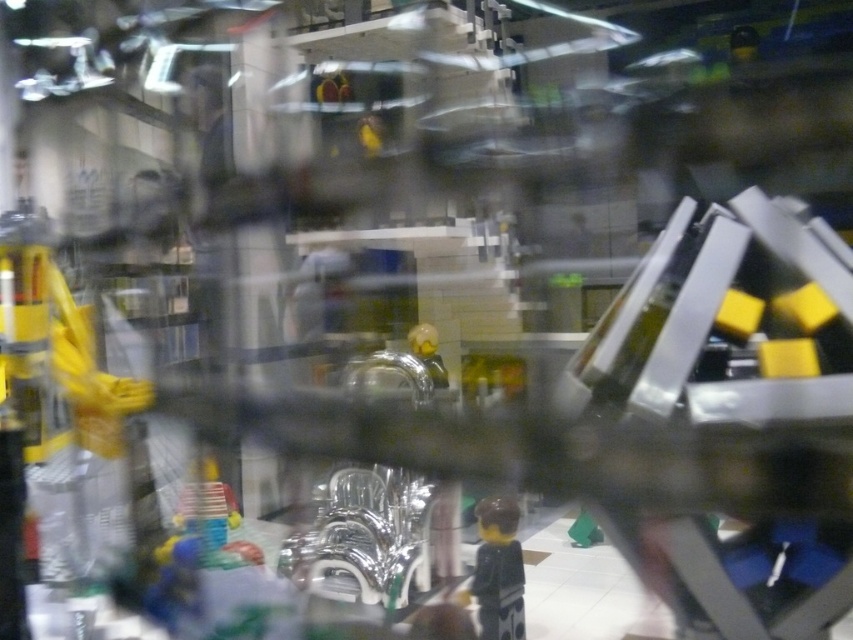
Which is above, smooth black minifigure at center or yellow matte toy at center?

yellow matte toy at center is above.

Can you confirm if smooth black minifigure at center is smaller than yellow matte toy at center?

Indeed, smooth black minifigure at center has a smaller size compared to yellow matte toy at center.

The height and width of the screenshot is (640, 853). Describe the element at coordinates (498, 570) in the screenshot. I see `smooth black minifigure at center` at that location.

The image size is (853, 640). What are the coordinates of `smooth black minifigure at center` in the screenshot? It's located at (498, 570).